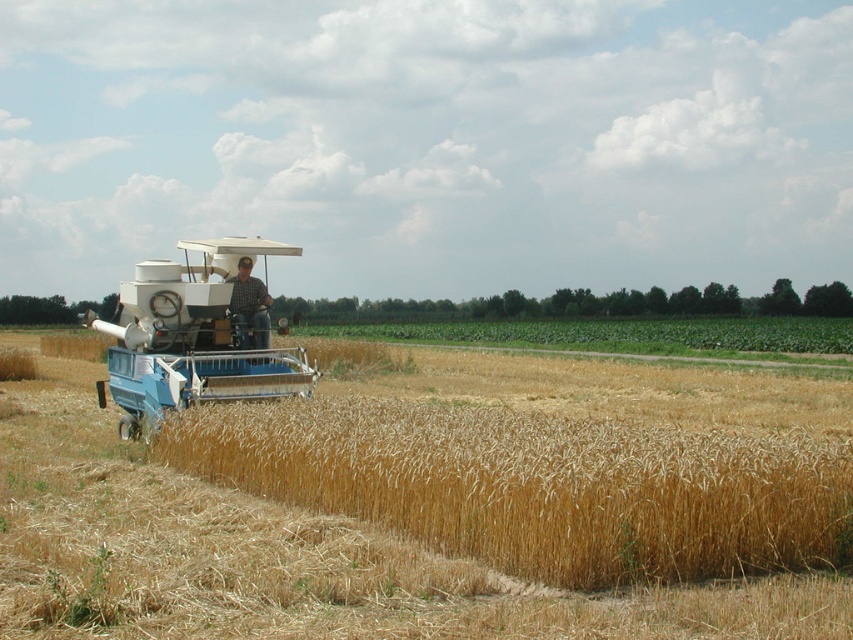
Is golden dry wheat at center positioned before blue metallic combine at center?

Yes.

Between point (85, 509) and point (138, 429), which one is positioned in front?

Point (85, 509)

Is point (424, 554) closer to camera compared to point (297, 252)?

Yes, point (424, 554) is in front of point (297, 252).

Identify the location of golden dry wheat at center. Image resolution: width=853 pixels, height=640 pixels. (289, 556).

Which is more to the left, blue metallic combine at center or plaid shirt at center?

blue metallic combine at center is more to the left.

Between blue metallic combine at center and plaid shirt at center, which one has less height?

plaid shirt at center

What do you see at coordinates (196, 336) in the screenshot? Image resolution: width=853 pixels, height=640 pixels. I see `blue metallic combine at center` at bounding box center [196, 336].

Identify the location of blue metallic combine at center. (196, 336).

Is golden dry wheat at center bigger than plaid shirt at center?

Yes, golden dry wheat at center is bigger than plaid shirt at center.

Is golden dry wheat at center closer to the viewer compared to plaid shirt at center?

That is True.

Is point (607, 604) positioned after point (242, 308)?

No, (607, 604) is closer to viewer.

At what (x,y) coordinates should I click in order to perform the action: click on golden dry wheat at center. Please return your answer as a coordinate pair (x, y). Looking at the image, I should click on (289, 556).